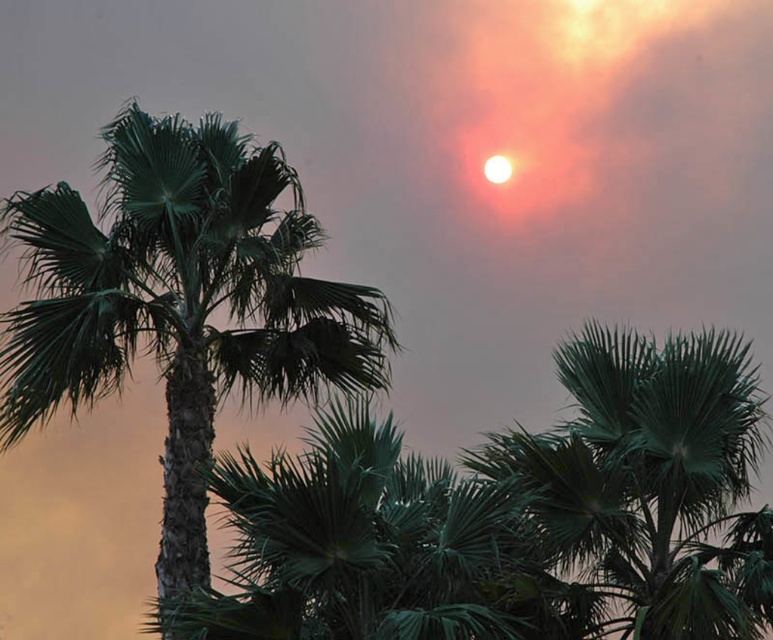
Question: Which object is farther from the camera taking this photo?

Choices:
 (A) green leafy palm tree at upper center
 (B) green leafy palm tree at center

Answer: (B)

Question: Is green leafy palm tree at center smaller than green leafy palm tree at upper center?

Choices:
 (A) no
 (B) yes

Answer: (A)

Question: Is green leafy palm tree at center below green leafy palm tree at upper center?

Choices:
 (A) no
 (B) yes

Answer: (A)

Question: Is green leafy palm tree at center smaller than green leafy palm tree at upper center?

Choices:
 (A) yes
 (B) no

Answer: (B)